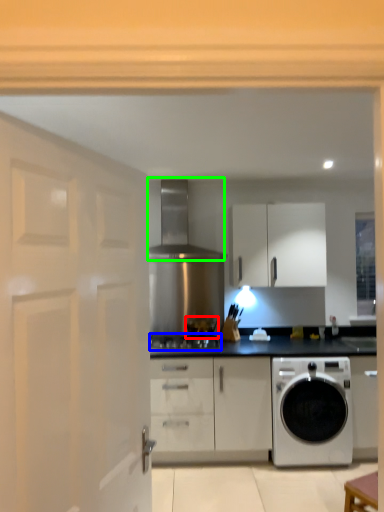
Question: Which is nearer to the appliance (highlighted by a red box)? gas stove (highlighted by a blue box) or exhaust hood (highlighted by a green box).

Choices:
 (A) gas stove
 (B) exhaust hood

Answer: (A)